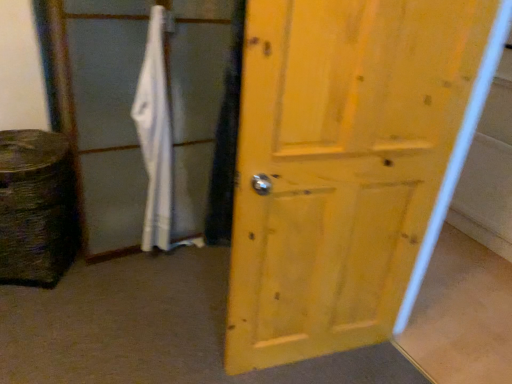
Find the location of a particular element. vacant space in yellow wood door at center (from a real-world perspective) is located at coordinates [x=318, y=360].